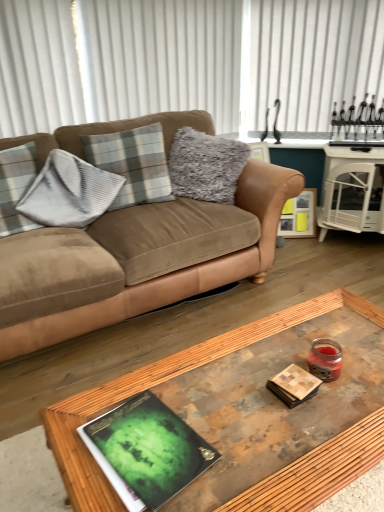
Question: Can you confirm if gray plaid pillow at left, the second pillow when ordered from right to left, is wider than green matte book at center?

Choices:
 (A) no
 (B) yes

Answer: (A)

Question: Is green matte book at center at the back of gray plaid pillow at left, the first pillow when ordered from left to right?

Choices:
 (A) yes
 (B) no

Answer: (B)

Question: Does gray plaid pillow at left, the first pillow when ordered from left to right, have a smaller size compared to green matte book at center?

Choices:
 (A) no
 (B) yes

Answer: (A)

Question: Would you consider gray plaid pillow at left, the second pillow when ordered from right to left, to be distant from green matte book at center?

Choices:
 (A) no
 (B) yes

Answer: (B)

Question: Is the surface of gray plaid pillow at left, the second pillow when ordered from right to left, in direct contact with green matte book at center?

Choices:
 (A) yes
 (B) no

Answer: (B)

Question: In terms of height, does suede brown couch at upper left look taller or shorter compared to plaid fabric pillow at center, arranged as the 2th pillow when viewed from the left?

Choices:
 (A) short
 (B) tall

Answer: (B)

Question: Considering the positions of suede brown couch at upper left and plaid fabric pillow at center, positioned as the 1th pillow in right-to-left order, in the image, is suede brown couch at upper left bigger or smaller than plaid fabric pillow at center, positioned as the 1th pillow in right-to-left order,?

Choices:
 (A) small
 (B) big

Answer: (B)

Question: Visually, is suede brown couch at upper left positioned to the left or to the right of plaid fabric pillow at center, positioned as the 1th pillow in right-to-left order?

Choices:
 (A) right
 (B) left

Answer: (A)

Question: Does point (16, 320) appear closer or farther from the camera than point (105, 150)?

Choices:
 (A) closer
 (B) farther

Answer: (A)

Question: Is wooden picture frame at right to the left or to the right of green matte book at center in the image?

Choices:
 (A) left
 (B) right

Answer: (B)

Question: From the image's perspective, is wooden picture frame at right positioned above or below green matte book at center?

Choices:
 (A) above
 (B) below

Answer: (A)

Question: Relative to green matte book at center, is wooden picture frame at right in front or behind?

Choices:
 (A) behind
 (B) front

Answer: (A)

Question: Do you think wooden picture frame at right is within green matte book at center, or outside of it?

Choices:
 (A) outside
 (B) inside

Answer: (A)

Question: Considering the positions of point (299, 230) and point (79, 489), is point (299, 230) closer or farther from the camera than point (79, 489)?

Choices:
 (A) farther
 (B) closer

Answer: (A)

Question: In the image, is wooden picture frame at right positioned in front of or behind wooden glass coffee table at center?

Choices:
 (A) front
 (B) behind

Answer: (B)